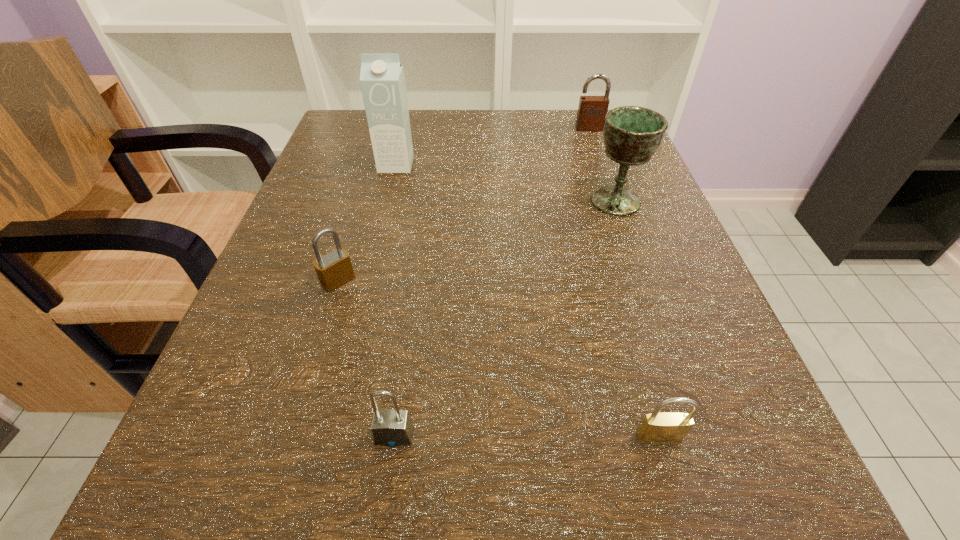
The height and width of the screenshot is (540, 960). What are the coordinates of `free space that satisfies the following two spatial constraints: 1. on the front label of the chalice; 2. on the left side of the tallest object` in the screenshot? It's located at (387, 201).